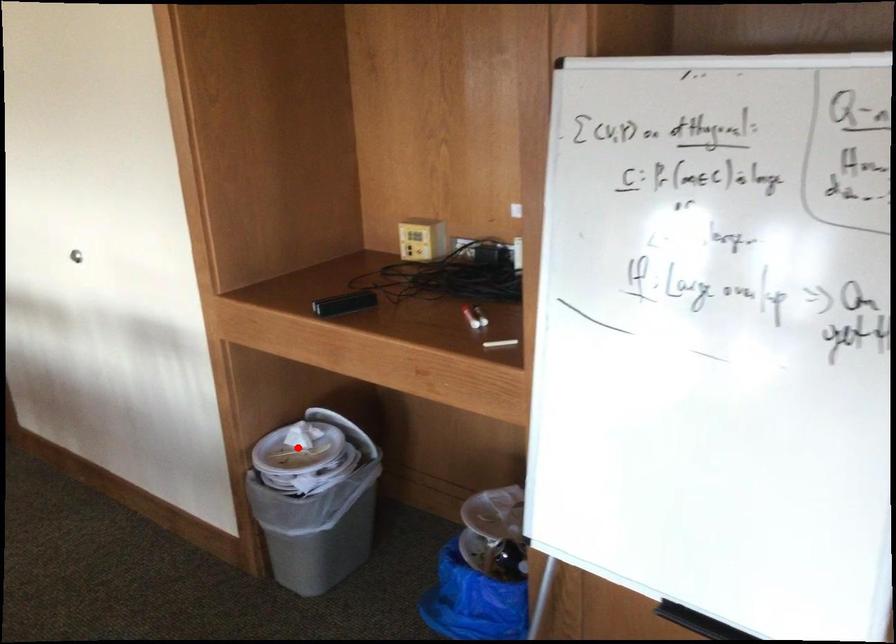
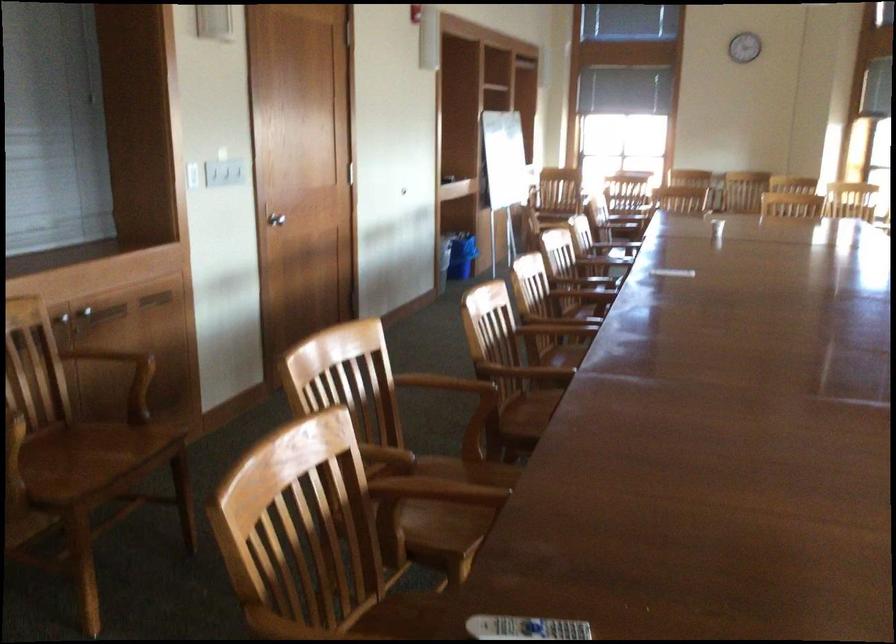
Question: I am providing you with two images of the same scene from different viewpoints. A red point is marked on the first image. Is the red point's position out of view in image 2?

Choices:
 (A) Yes
 (B) No

Answer: (A)